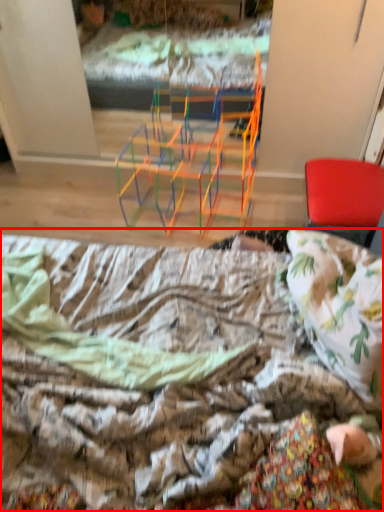
Question: From the image's perspective, where is bed (annotated by the red box) located relative to chair?

Choices:
 (A) below
 (B) above

Answer: (A)